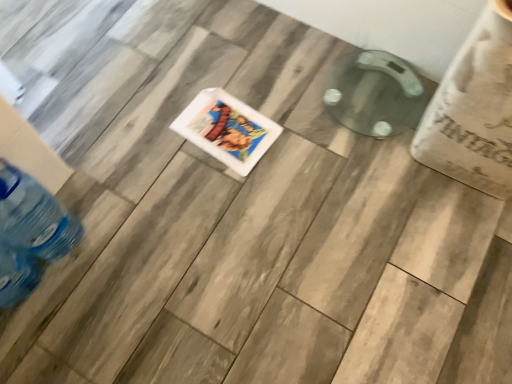
Image resolution: width=512 pixels, height=384 pixels. What are the coordinates of `vacant area that is in front of white glossy comic book at center` in the screenshot? It's located at (220, 200).